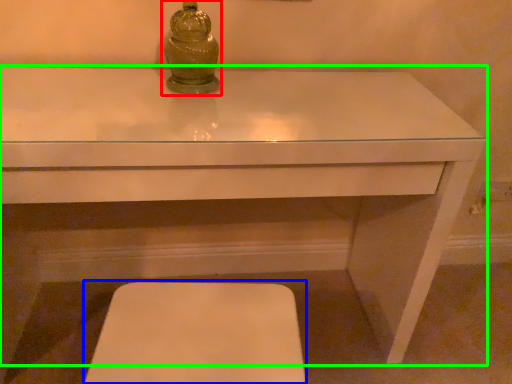
Question: Which object is positioned farthest from candle holder (highlighted by a red box)? Select from step stool (highlighted by a blue box) and table (highlighted by a green box).

Choices:
 (A) step stool
 (B) table

Answer: (A)